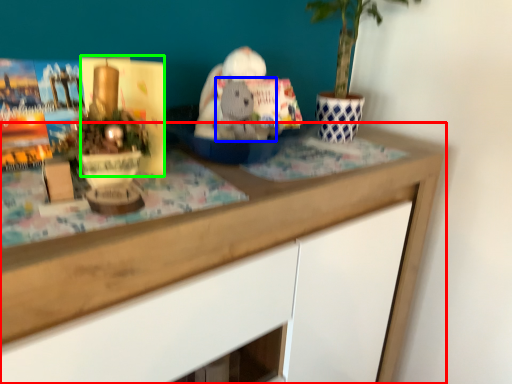
Question: Based on their relative distances, which object is farther from desk (highlighted by a red box)? Choose from animal (highlighted by a blue box) and paperback book (highlighted by a green box).

Choices:
 (A) animal
 (B) paperback book

Answer: (B)